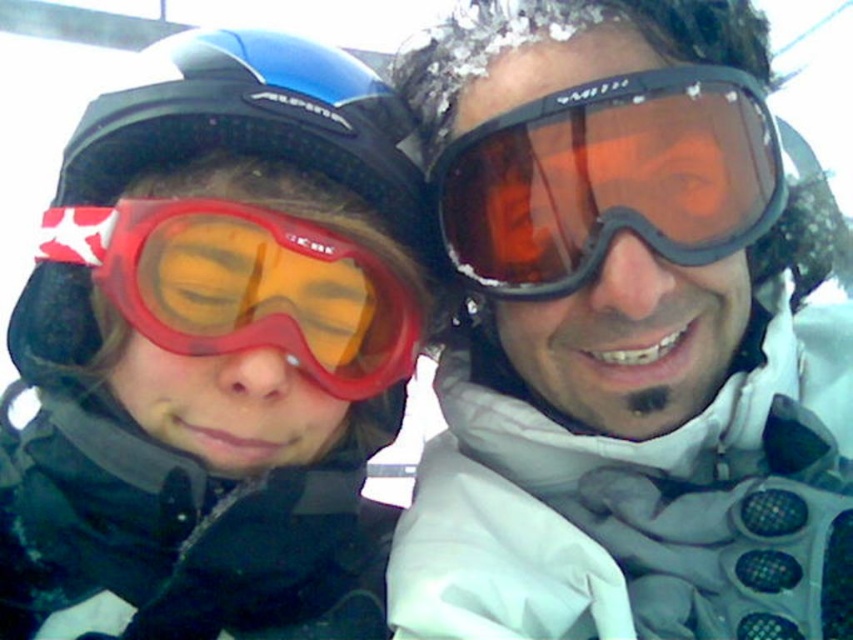
Which of these two, matte orange lens goggles at center or matte red ski goggles at left, stands shorter?

With less height is matte red ski goggles at left.

What do you see at coordinates (610, 179) in the screenshot?
I see `matte orange lens goggles at center` at bounding box center [610, 179].

Image resolution: width=853 pixels, height=640 pixels. Identify the location of matte orange lens goggles at center. (610, 179).